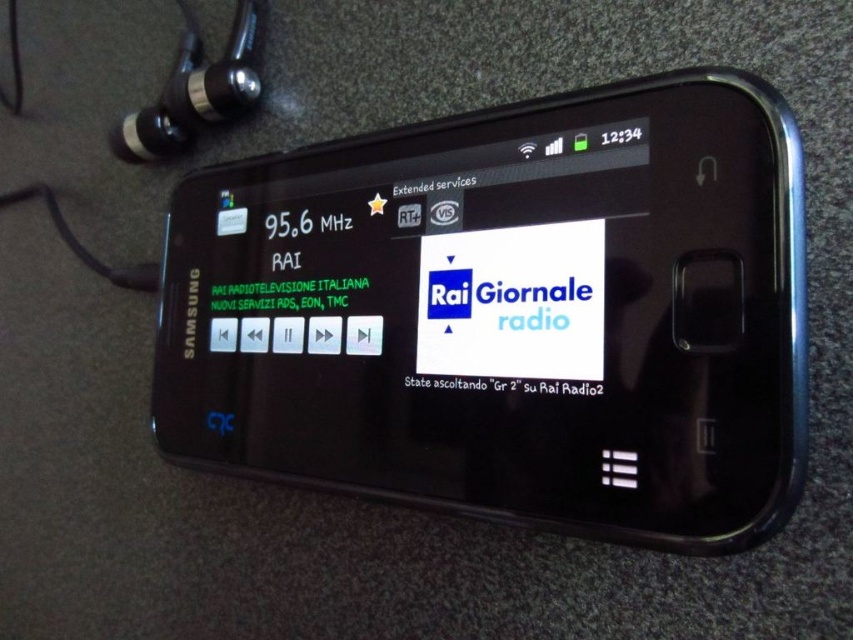
You are trying to decide whether to place the black metallic earphone at upper left into the charging dock located near the black plastic smartphone at center. Based on their sizes, will the earphone fit into the smartphone?

The black plastic smartphone at center is larger in size than the black metallic earphone at upper left, so the earphone should fit into the smartphone as long as the physical ports or connectors are compatible.

Looking at this image, you are holding a remote control and want to place it on the surface where the black plastic smartphone at center is located. However, there is a black metallic earphone at upper left nearby. Can you place the remote control next to the smartphone without moving the earphone?

The black plastic smartphone at center is closer to the viewer than the black metallic earphone at upper left, so placing the remote control next to the smartphone would require moving the earphone since it is further away.